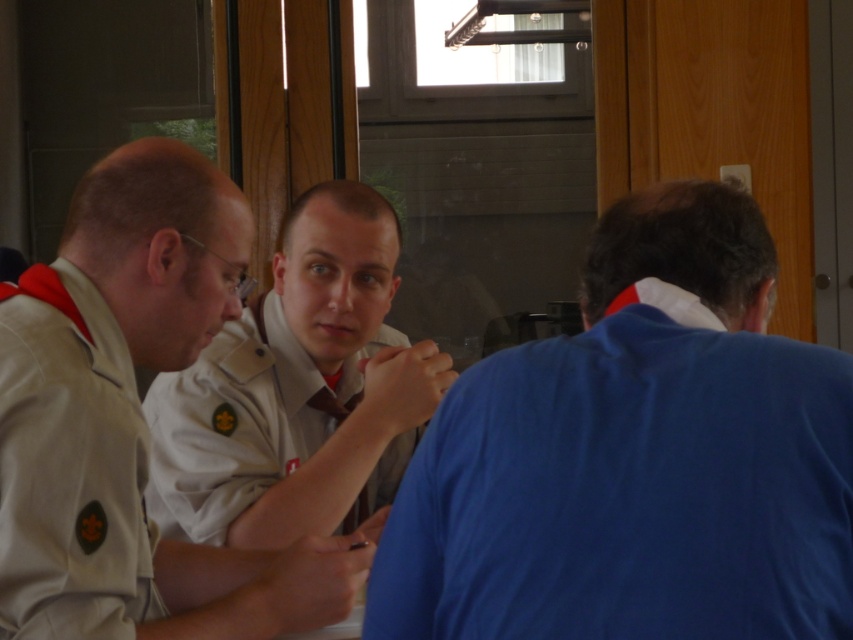
Describe the element at coordinates (242, 420) in the screenshot. This screenshot has height=640, width=853. I see `tan uniform at center` at that location.

This screenshot has width=853, height=640. What do you see at coordinates (242, 420) in the screenshot? I see `tan uniform at center` at bounding box center [242, 420].

Locate an element on the screen. The height and width of the screenshot is (640, 853). tan uniform at center is located at coordinates (x=242, y=420).

Does blue cotton shirt at right have a lesser height compared to tan uniform at left?

No, blue cotton shirt at right is not shorter than tan uniform at left.

Find the location of a particular element. blue cotton shirt at right is located at coordinates (636, 458).

Is point (3, 333) positioned before point (247, 458)?

Yes, point (3, 333) is in front of point (247, 458).

Looking at this image, between tan uniform at left and tan uniform at center, which one has less height?

Standing shorter between the two is tan uniform at center.

Between point (15, 550) and point (154, 412), which one is positioned behind?

Positioned behind is point (154, 412).

The height and width of the screenshot is (640, 853). Find the location of `tan uniform at left`. tan uniform at left is located at coordinates (70, 467).